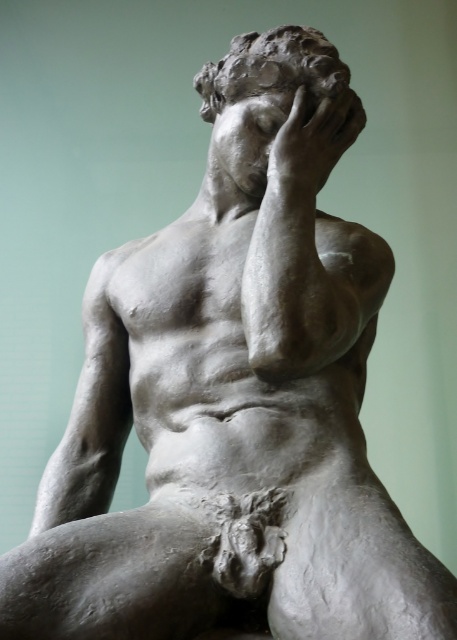
Can you confirm if matte gray sculpture at center is positioned to the right of matte gray hand at upper center?

Incorrect, matte gray sculpture at center is not on the right side of matte gray hand at upper center.

Can you confirm if matte gray sculpture at center is wider than matte gray hand at upper center?

Correct, the width of matte gray sculpture at center exceeds that of matte gray hand at upper center.

The image size is (457, 640). Find the location of `matte gray sculpture at center`. matte gray sculpture at center is located at coordinates (271, 67).